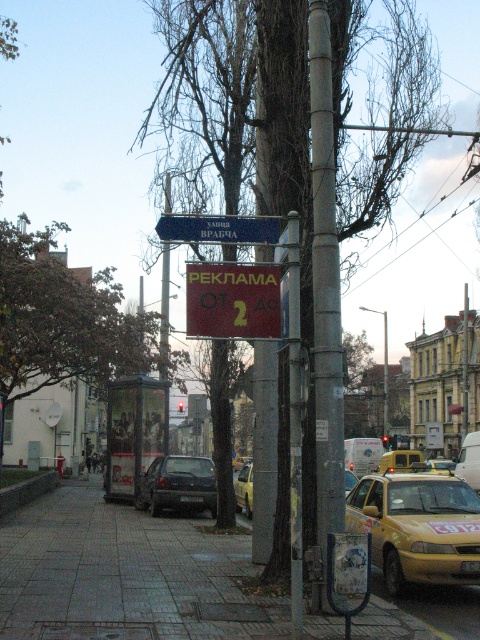
Question: Estimate the real-world distances between objects in this image. Which object is farther from the brown bark tree at center?

Choices:
 (A) blue plastic sign at upper center
 (B) gray concrete sidewalk at center
 (C) dark gray matte car at center
 (D) red plastic sign at center

Answer: (A)

Question: Which of the following is the farthest from the observer?

Choices:
 (A) (206, 582)
 (B) (435, 516)

Answer: (B)

Question: Does gray concrete sidewalk at center have a lesser width compared to yellow matte taxi at center?

Choices:
 (A) no
 (B) yes

Answer: (A)

Question: Can you confirm if metallic gray pole at center is positioned below dark gray matte car at center?

Choices:
 (A) no
 (B) yes

Answer: (A)

Question: Which of the following is the closest to the observer?

Choices:
 (A) (265, 301)
 (B) (230, 548)
 (C) (197, 490)
 (D) (211, 240)

Answer: (D)

Question: Is yellow matte taxi at lower right wider than red plastic sign at center?

Choices:
 (A) no
 (B) yes

Answer: (A)